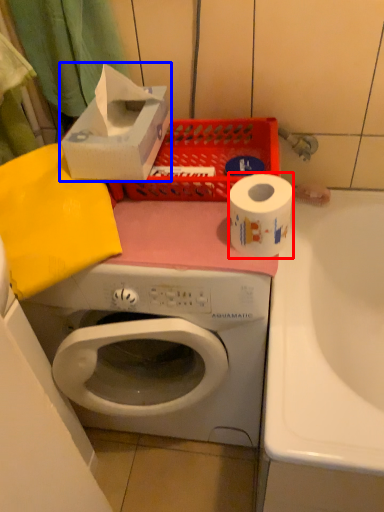
Question: Which of the following is the closest to the observer, toilet paper (highlighted by a red box) or storage box (highlighted by a blue box)?

Choices:
 (A) toilet paper
 (B) storage box

Answer: (A)